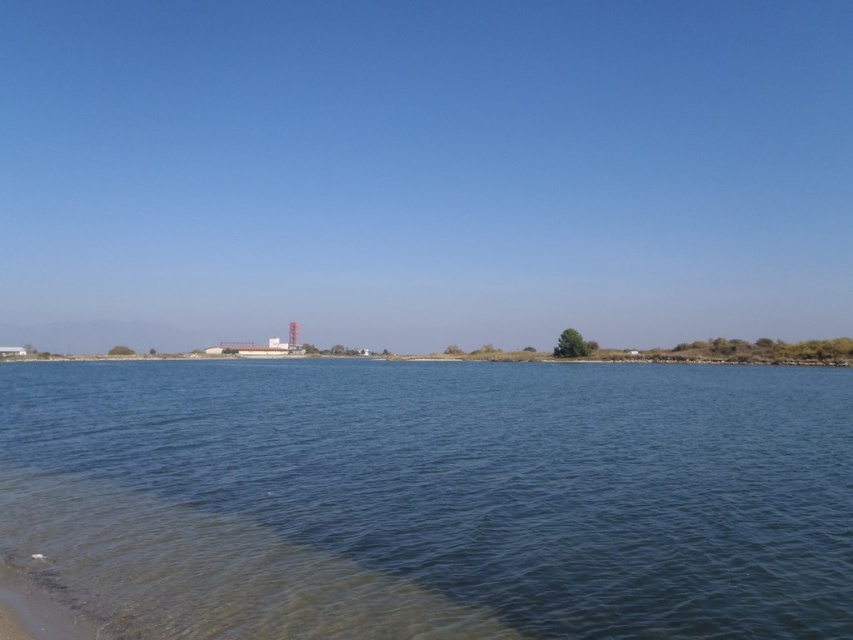
Is blue water at center above sandy beach at lower left?

Actually, blue water at center is below sandy beach at lower left.

Which is below, blue water at center or sandy beach at lower left?

blue water at center is lower down.

Between point (714, 449) and point (3, 566), which one is positioned behind?

Positioned behind is point (714, 449).

The image size is (853, 640). What are the coordinates of `blue water at center` in the screenshot? It's located at (434, 499).